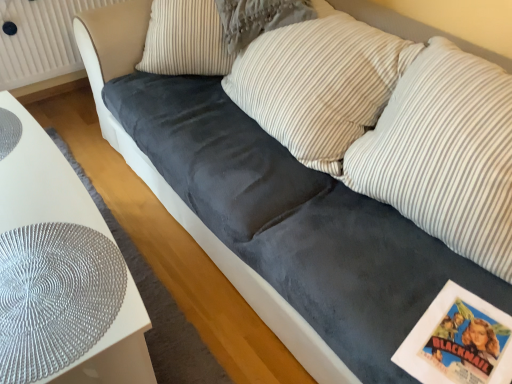
Question: Would you say white glossy table at lower left is to the left or to the right of striped fabric pillow at center, placed as the 3th pillow when sorted from right to left, in the picture?

Choices:
 (A) left
 (B) right

Answer: (A)

Question: Does point (50, 306) appear closer or farther from the camera than point (249, 34)?

Choices:
 (A) farther
 (B) closer

Answer: (B)

Question: Which is farther from the white textured radiator at upper left?

Choices:
 (A) striped fabric pillow at center, the 2th pillow when ordered from left to right
 (B) white glossy table at lower left
 (C) white striped pillow at center, positioned as the second pillow in right-to-left order
 (D) striped fabric pillow at center, arranged as the fourth pillow when viewed from the left
 (E) velvet gray pillow at center, which is the 4th pillow from right to left

Answer: (D)

Question: Which object is the closest to the white glossy table at lower left?

Choices:
 (A) striped fabric pillow at center, arranged as the fourth pillow when viewed from the left
 (B) white striped pillow at center, acting as the 3th pillow starting from the left
 (C) striped fabric pillow at center, placed as the 3th pillow when sorted from right to left
 (D) velvet gray pillow at center, which is the 4th pillow from right to left
 (E) white textured radiator at upper left

Answer: (D)